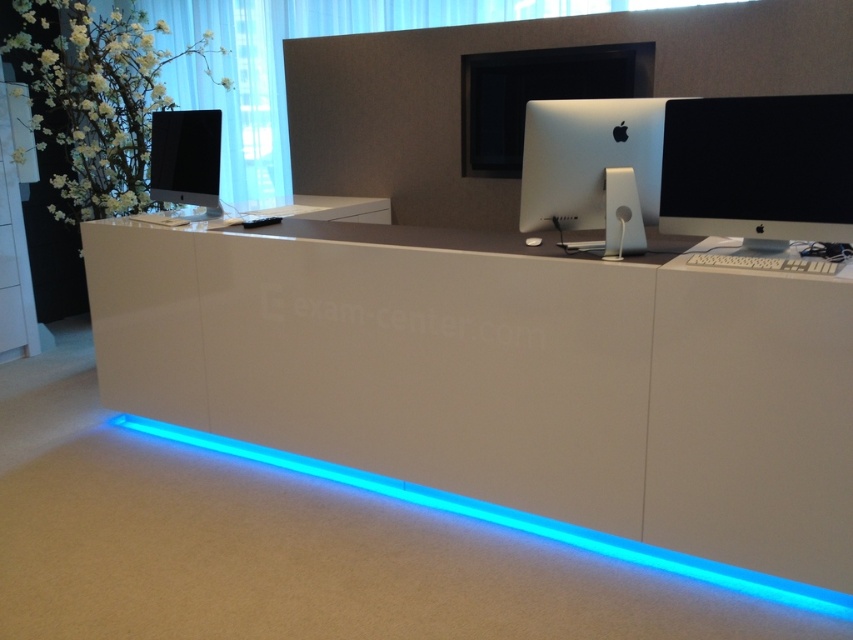
You are a visitor at the office reception area. You see a point marked at coordinates (758, 168). Which object is this point located on?

The point at coordinates (758, 168) is located on the black glossy monitor at right.

You are an office worker who needs to place a new keyboard that is 15 cm wide. You see the black glossy monitor at right and the matte black monitor at left on the desk. Which monitor has enough space next to it to fit the keyboard?

The matte black monitor at left has a greater width than the black glossy monitor at right, so there is more space next to it to accommodate the 15 cm wide keyboard.

You are a technician who needs to connect the sleek silver imac at center to the blue led strip at lower center using a cable that is 4 feet long. Will the cable be long enough?

The sleek silver imac at center and blue led strip at lower center are 4.23 feet apart. The cable is only 4 feet long, so it will be 0.23 feet short. Therefore, the cable will not be long enough.